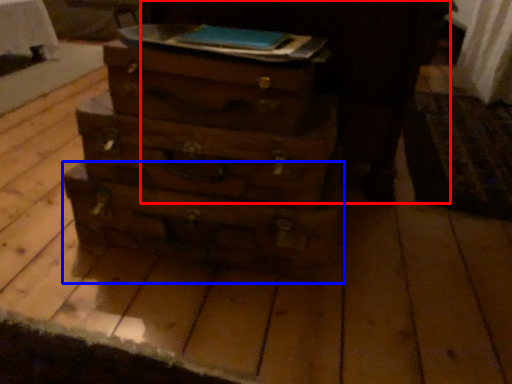
Question: Among these objects, which one is farthest to the camera, dark (highlighted by a red box) or drawer (highlighted by a blue box)?

Choices:
 (A) dark
 (B) drawer

Answer: (A)